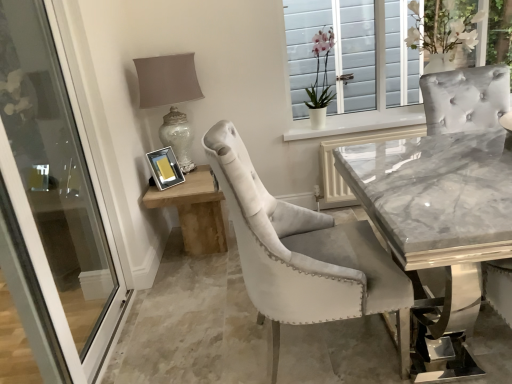
Question: Is velvet chair at center thinner than pink velvet orchid at upper center?

Choices:
 (A) no
 (B) yes

Answer: (A)

Question: From a real-world perspective, is velvet chair at center under pink velvet orchid at upper center?

Choices:
 (A) yes
 (B) no

Answer: (A)

Question: Is velvet chair at center oriented away from pink velvet orchid at upper center?

Choices:
 (A) yes
 (B) no

Answer: (B)

Question: Is velvet chair at center outside pink velvet orchid at upper center?

Choices:
 (A) yes
 (B) no

Answer: (A)

Question: From a real-world perspective, is velvet chair at center located higher than pink velvet orchid at upper center?

Choices:
 (A) yes
 (B) no

Answer: (B)

Question: Is metallic silver picture frame at upper center in front of or behind velvet chair at center in the image?

Choices:
 (A) front
 (B) behind

Answer: (B)

Question: Is metallic silver picture frame at upper center wider or thinner than velvet chair at center?

Choices:
 (A) thin
 (B) wide

Answer: (A)

Question: From the image's perspective, is metallic silver picture frame at upper center above or below velvet chair at center?

Choices:
 (A) below
 (B) above

Answer: (B)

Question: From their relative heights in the image, would you say metallic silver picture frame at upper center is taller or shorter than velvet chair at center?

Choices:
 (A) short
 (B) tall

Answer: (B)

Question: Based on their sizes in the image, would you say matte silver table lamp at upper left is bigger or smaller than wooden side table at lower left?

Choices:
 (A) small
 (B) big

Answer: (A)

Question: Visually, is matte silver table lamp at upper left positioned to the left or to the right of wooden side table at lower left?

Choices:
 (A) right
 (B) left

Answer: (B)

Question: In terms of width, does matte silver table lamp at upper left look wider or thinner when compared to wooden side table at lower left?

Choices:
 (A) wide
 (B) thin

Answer: (B)

Question: Is matte silver table lamp at upper left situated inside wooden side table at lower left or outside?

Choices:
 (A) outside
 (B) inside

Answer: (A)

Question: From the image's perspective, is metallic silver picture frame at upper center positioned above or below pink velvet orchid at upper center?

Choices:
 (A) below
 (B) above

Answer: (A)

Question: From a real-world perspective, relative to pink velvet orchid at upper center, is metallic silver picture frame at upper center vertically above or below?

Choices:
 (A) below
 (B) above

Answer: (A)